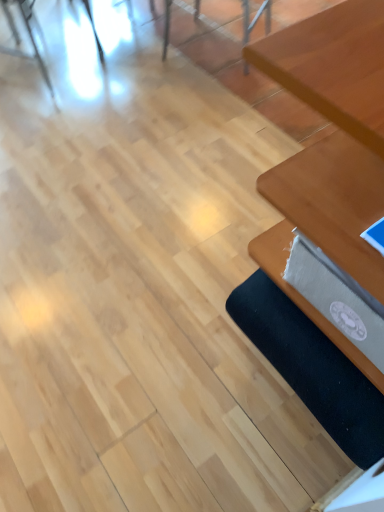
Question: Is wooden table at right wider or thinner than metallic silver chair at upper left, which is the 1th chair from left to right?

Choices:
 (A) thin
 (B) wide

Answer: (B)

Question: Is wooden table at right to the left or to the right of metallic silver chair at upper left, which is the second chair from right to left, in the image?

Choices:
 (A) right
 (B) left

Answer: (A)

Question: Which object is the farthest from the wooden chair at upper center, which is counted as the 2th chair, starting from the left?

Choices:
 (A) wooden table at right
 (B) black fabric yoga mat at lower right
 (C) metallic silver chair at upper left, which is the 1th chair from left to right

Answer: (B)

Question: Estimate the real-world distances between objects in this image. Which object is closer to the black fabric yoga mat at lower right?

Choices:
 (A) metallic silver chair at upper left, which is the 1th chair from left to right
 (B) wooden table at right
 (C) wooden chair at upper center, which ranks as the first chair in right-to-left order

Answer: (B)